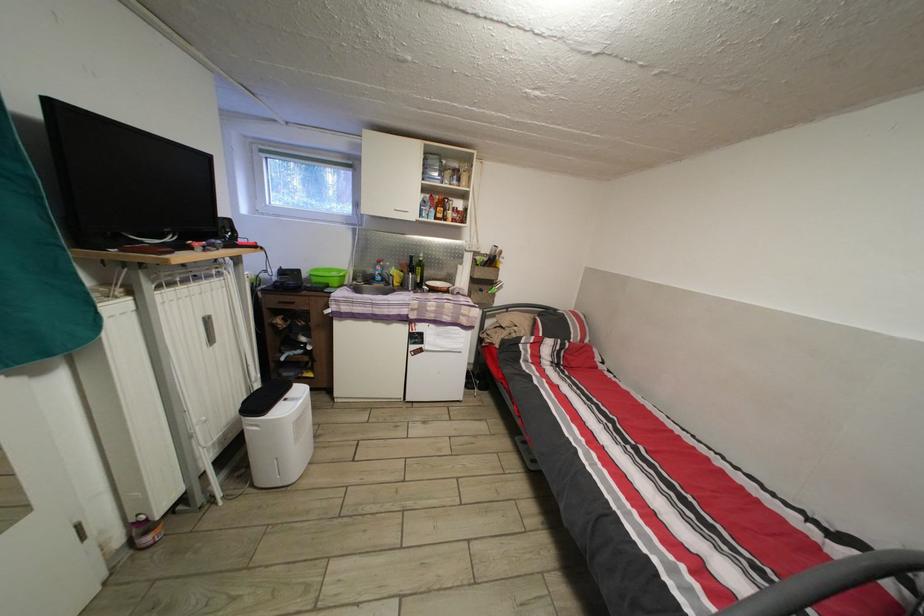
The height and width of the screenshot is (616, 924). Find the location of `green plastic bowl`. green plastic bowl is located at coordinates (327, 276).